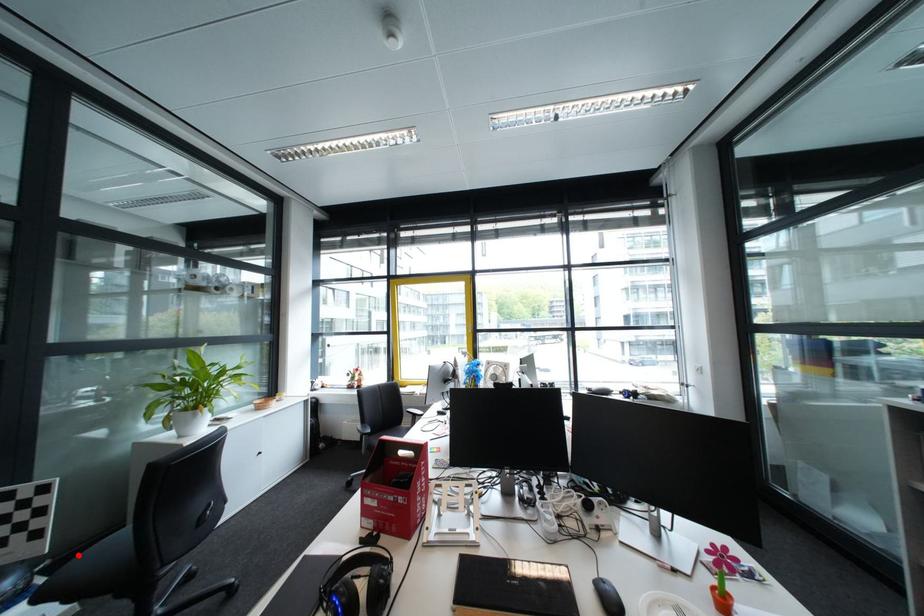
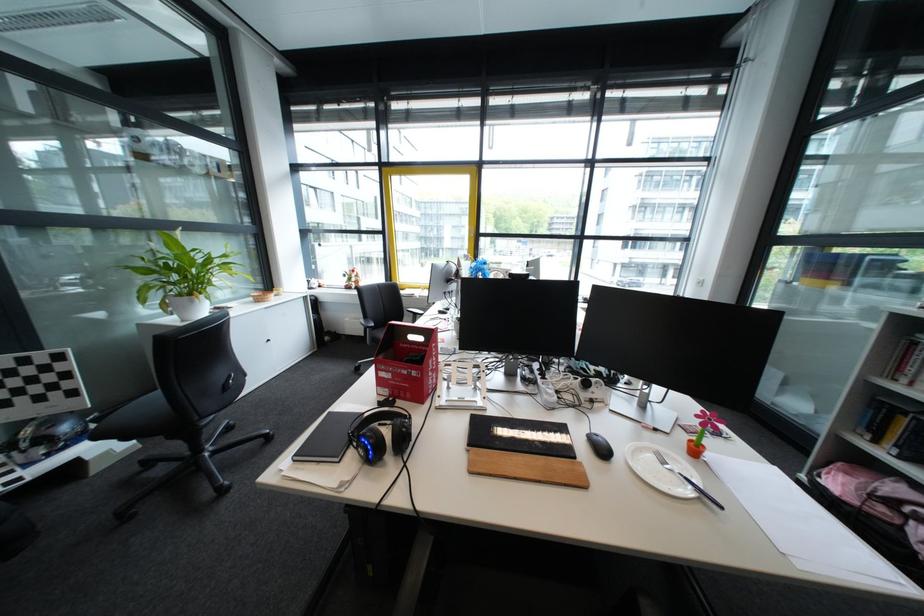
Where in the second image is the point corresponding to the highlighted location from the first image?

(120, 410)